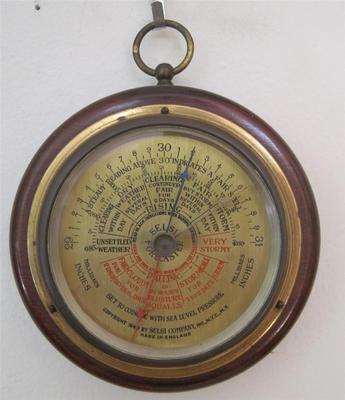
The height and width of the screenshot is (400, 345). What are the coordinates of `grey hook on wall` in the screenshot? It's located at (162, 11).